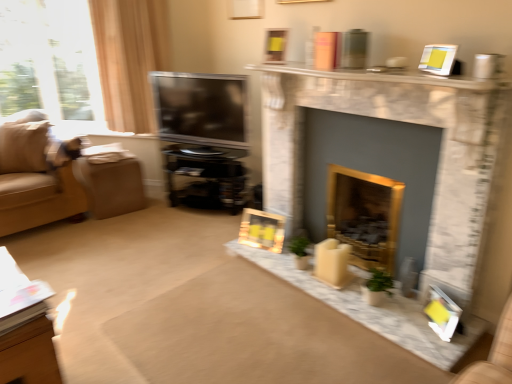
What are the coordinates of `vacant space to the left of matte white picture frame at lower right, which is counted as the first picture frame, starting from the front` in the screenshot? It's located at (407, 323).